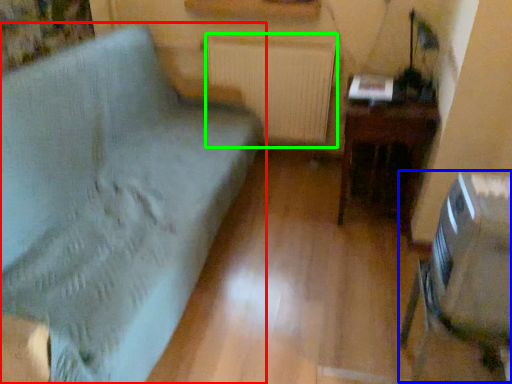
Question: Estimate the real-world distances between objects in this image. Which object is closer to furniture (highlighted by a red box), swivel chair (highlighted by a blue box) or radiator (highlighted by a green box)?

Choices:
 (A) swivel chair
 (B) radiator

Answer: (B)